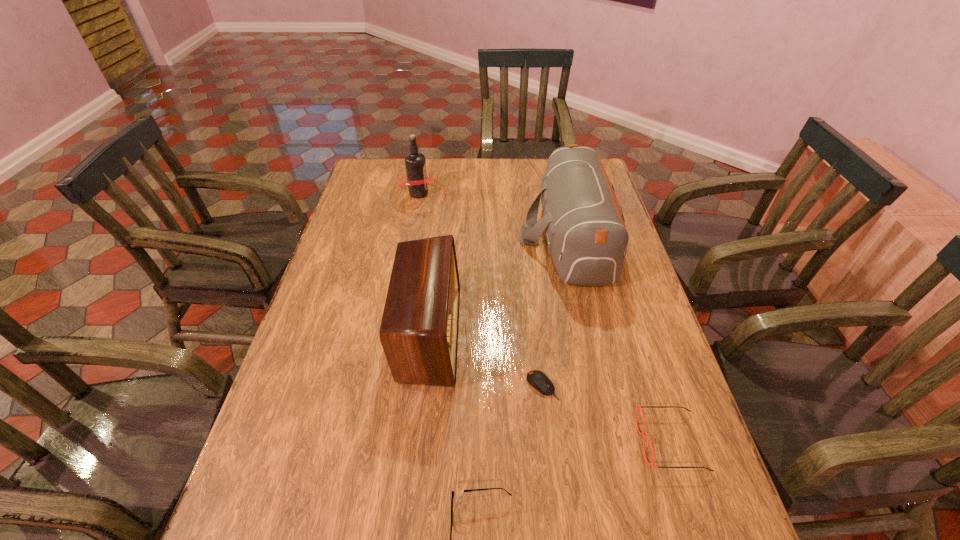
In the image, there is a desktop. At what (x,y) coordinates should I click in order to perform the action: click on free region at the far edge. Please return your answer as a coordinate pair (x, y). Looking at the image, I should click on (458, 177).

Where is `free space at the left edge of the desktop`? The width and height of the screenshot is (960, 540). free space at the left edge of the desktop is located at coordinates (344, 225).

Locate an element on the screen. The image size is (960, 540). blank space at the right edge of the desktop is located at coordinates (613, 378).

This screenshot has width=960, height=540. I want to click on vacant area that lies between the duffel bag and the radio receiver, so (x=499, y=285).

At what (x,y) coordinates should I click in order to perform the action: click on vacant area that lies between the farther spectacles and the duffel bag. Please return your answer as a coordinate pair (x, y). Image resolution: width=960 pixels, height=540 pixels. Looking at the image, I should click on (620, 339).

Where is `free spot between the second nearest object and the computer mouse`? free spot between the second nearest object and the computer mouse is located at coordinates (607, 414).

The image size is (960, 540). Find the location of `empty space between the root beer and the duffel bag`. empty space between the root beer and the duffel bag is located at coordinates (494, 214).

The height and width of the screenshot is (540, 960). Identify the location of vacant space that is in between the radio receiver and the duffel bag. (499, 285).

Locate an element on the screen. The height and width of the screenshot is (540, 960). empty location between the farther spectacles and the shortest object is located at coordinates (607, 414).

The image size is (960, 540). Identify the location of empty location between the second nearest object and the root beer. pos(545,318).